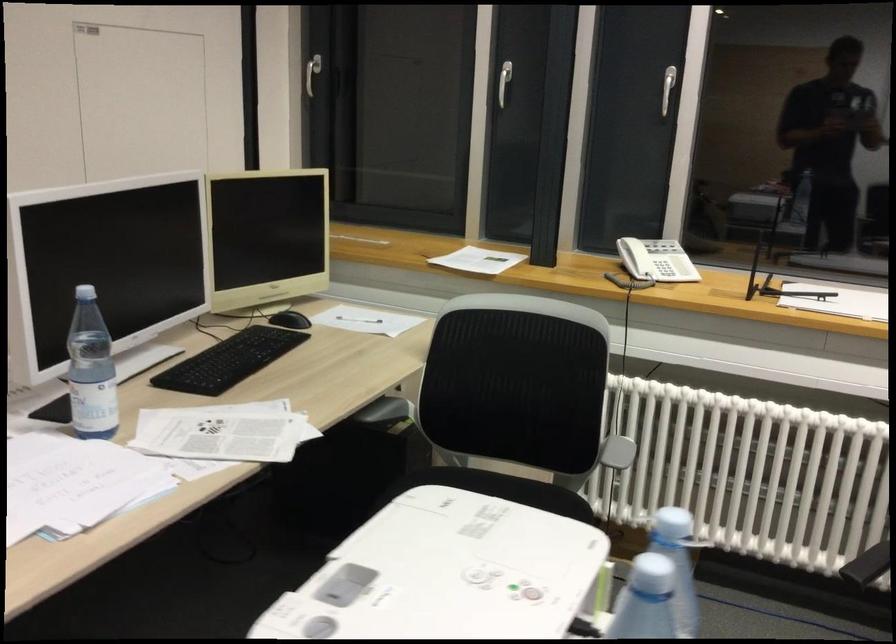
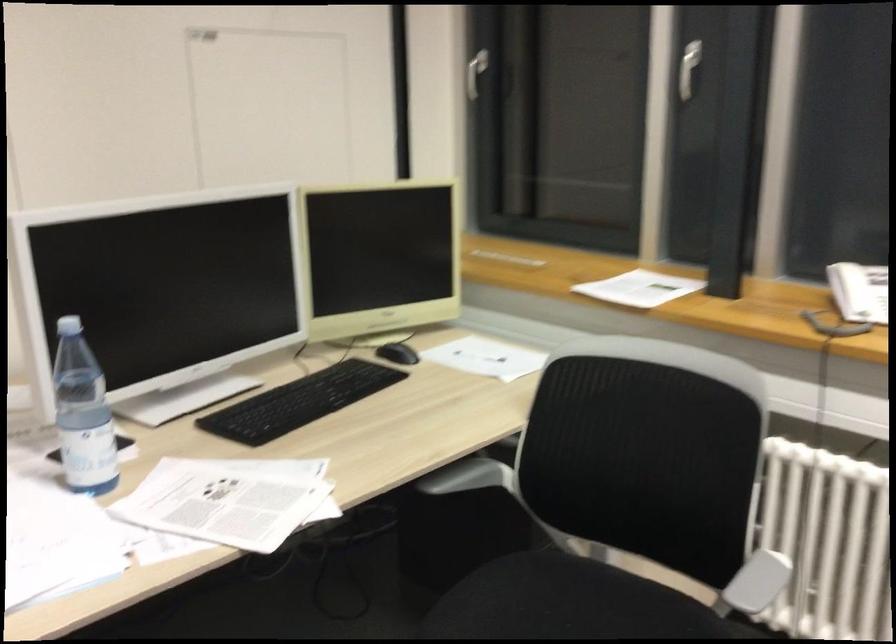
Find the pixel in the second image that matches [501,84] in the first image.

(688, 69)